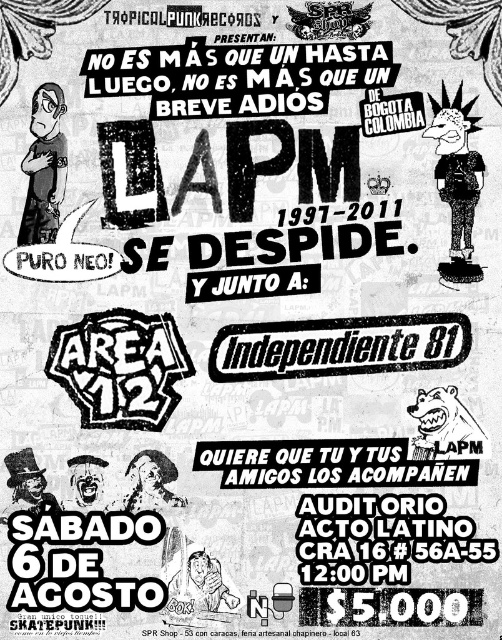
Question: Can you confirm if matte black shirt at left is positioned to the right of black bear at lower right?

Choices:
 (A) no
 (B) yes

Answer: (A)

Question: Is black textured sticker at center behind black bear at lower right?

Choices:
 (A) yes
 (B) no

Answer: (A)

Question: Among these points, which one is farthest from the camera?

Choices:
 (A) (105, 320)
 (B) (448, 438)
 (C) (274, 321)

Answer: (A)

Question: Among these objects, which one is farthest from the camera?

Choices:
 (A) black textured sticker at center
 (B) black rubber logo at center

Answer: (A)

Question: Estimate the real-world distances between objects in this image. Which object is closer to the black bear at lower right?

Choices:
 (A) black textured sticker at center
 (B) black textured shirt at upper right

Answer: (A)

Question: Can you confirm if black rubber logo at center is positioned to the left of matte black shirt at left?

Choices:
 (A) yes
 (B) no

Answer: (B)